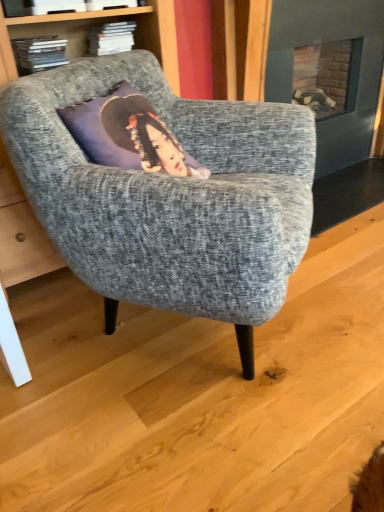
Question: Considering the positions of point (36, 60) and point (51, 216), is point (36, 60) closer or farther from the camera than point (51, 216)?

Choices:
 (A) closer
 (B) farther

Answer: (B)

Question: In terms of width, does hardcover book at upper left look wider or thinner when compared to textured gray armchair at center?

Choices:
 (A) wide
 (B) thin

Answer: (B)

Question: Visually, is hardcover book at upper left positioned to the left or to the right of textured gray armchair at center?

Choices:
 (A) left
 (B) right

Answer: (A)

Question: Is textured gray armchair at center spatially inside hardcover book at upper left, or outside of it?

Choices:
 (A) outside
 (B) inside

Answer: (A)

Question: From the image's perspective, is textured gray armchair at center above or below hardcover book at upper left?

Choices:
 (A) below
 (B) above

Answer: (A)

Question: Is textured gray armchair at center to the left or to the right of hardcover book at upper left in the image?

Choices:
 (A) left
 (B) right

Answer: (B)

Question: Is textured gray armchair at center wider or thinner than hardcover book at upper left?

Choices:
 (A) wide
 (B) thin

Answer: (A)